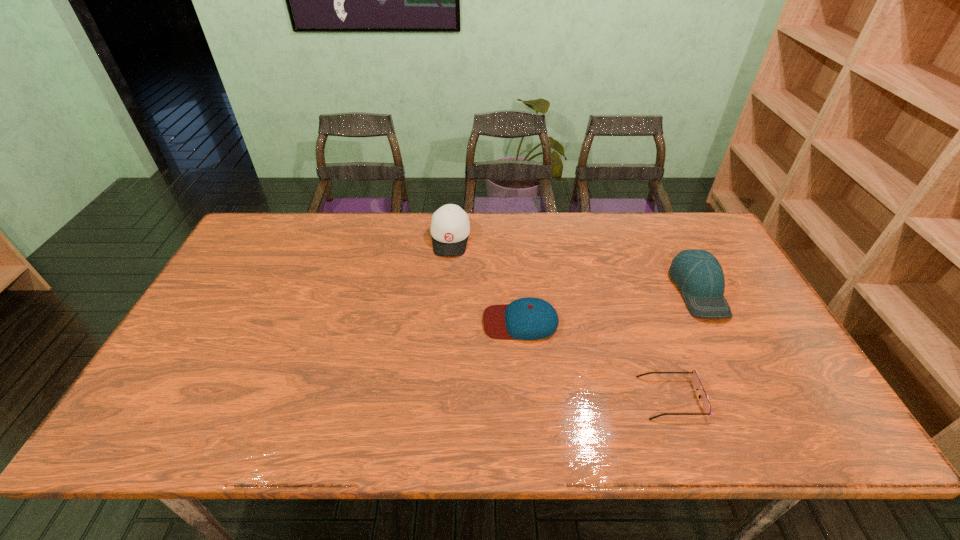
Identify the location of blank space at the left edge of the desktop. (207, 369).

This screenshot has width=960, height=540. I want to click on vacant space at the right edge of the desktop, so click(748, 372).

Identify the location of free location at the far left corner of the desktop. (259, 217).

You are a GUI agent. You are given a task and a screenshot of the screen. Output one action in this format:
    pyautogui.click(x=<x>, y=<y>)
    Task: Click on the vacant region between the shortest baseball cap and the shortest object
    
    Given the screenshot: What is the action you would take?
    click(596, 360)

Image resolution: width=960 pixels, height=540 pixels. What are the coordinates of `vacant area between the second object from right to left and the leftmost baseball cap` in the screenshot? It's located at (561, 318).

Find the location of a particular element. The image size is (960, 540). free area in between the shortest object and the rightmost object is located at coordinates (685, 343).

At what (x,y) coordinates should I click in order to perform the action: click on free space between the rightmost object and the leftmost baseball cap. Please return your answer as a coordinate pair (x, y). The image size is (960, 540). Looking at the image, I should click on (574, 264).

At what (x,y) coordinates should I click in order to perform the action: click on unoccupied position between the farthest baseball cap and the sunglasses. Please return your answer as a coordinate pair (x, y). This screenshot has width=960, height=540. Looking at the image, I should click on (561, 318).

I want to click on vacant area that lies between the rightmost baseball cap and the sunglasses, so click(685, 343).

Where is `free space between the second baseball cap from left to right and the rightmost object`? Image resolution: width=960 pixels, height=540 pixels. free space between the second baseball cap from left to right and the rightmost object is located at coordinates (610, 306).